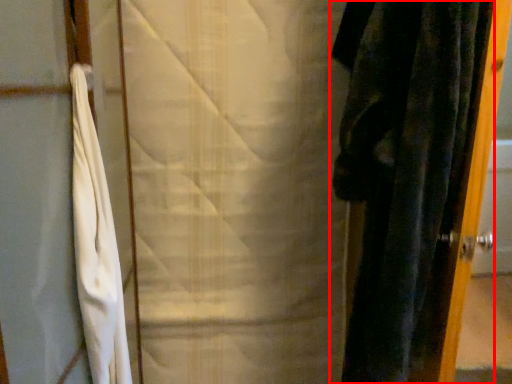
Question: From the image's perspective, considering the relative positions of curtain (annotated by the red box) and curtain in the image provided, where is curtain (annotated by the red box) located with respect to the staircase?

Choices:
 (A) above
 (B) below

Answer: (B)